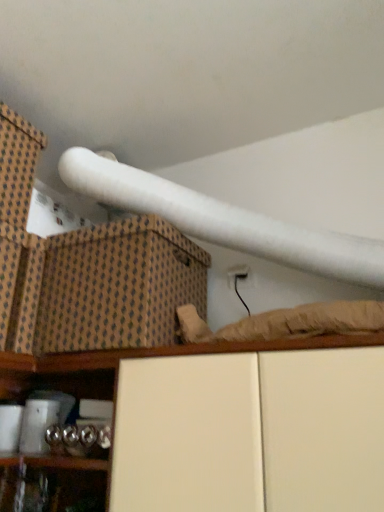
Question: Considering the relative positions of brown textured cardboard box at upper left and white matte cabinet at lower center in the image provided, is brown textured cardboard box at upper left to the right of white matte cabinet at lower center from the viewer's perspective?

Choices:
 (A) no
 (B) yes

Answer: (A)

Question: Is brown textured cardboard box at upper left positioned beyond the bounds of white matte cabinet at lower center?

Choices:
 (A) yes
 (B) no

Answer: (A)

Question: Is brown textured cardboard box at upper left not near white matte cabinet at lower center?

Choices:
 (A) yes
 (B) no

Answer: (B)

Question: Is brown textured cardboard box at upper left wider than white matte cabinet at lower center?

Choices:
 (A) no
 (B) yes

Answer: (B)

Question: From a real-world perspective, is brown textured cardboard box at upper left on top of white matte cabinet at lower center?

Choices:
 (A) no
 (B) yes

Answer: (B)

Question: Considering the positions of point (1, 117) and point (165, 310), is point (1, 117) closer or farther from the camera than point (165, 310)?

Choices:
 (A) closer
 (B) farther

Answer: (B)

Question: From the image's perspective, is brown woven box at upper left located above or below brown textured cardboard box at upper left?

Choices:
 (A) above
 (B) below

Answer: (A)

Question: Considering the positions of brown woven box at upper left and brown textured cardboard box at upper left in the image, is brown woven box at upper left wider or thinner than brown textured cardboard box at upper left?

Choices:
 (A) thin
 (B) wide

Answer: (A)

Question: From a real-world perspective, is brown woven box at upper left above or below brown textured cardboard box at upper left?

Choices:
 (A) below
 (B) above

Answer: (B)

Question: Based on their sizes in the image, would you say brown woven box at upper left is bigger or smaller than white matte cabinet at lower center?

Choices:
 (A) big
 (B) small

Answer: (B)

Question: From the image's perspective, relative to white matte cabinet at lower center, is brown woven box at upper left above or below?

Choices:
 (A) above
 (B) below

Answer: (A)

Question: Considering their positions, is brown woven box at upper left located in front of or behind white matte cabinet at lower center?

Choices:
 (A) front
 (B) behind

Answer: (B)

Question: Considering the positions of brown woven box at upper left and white matte cabinet at lower center in the image, is brown woven box at upper left taller or shorter than white matte cabinet at lower center?

Choices:
 (A) short
 (B) tall

Answer: (A)

Question: From a real-world perspective, is brown textured cardboard box at upper left above or below white matte cabinet at lower center?

Choices:
 (A) below
 (B) above

Answer: (B)

Question: In terms of height, does brown textured cardboard box at upper left look taller or shorter compared to white matte cabinet at lower center?

Choices:
 (A) short
 (B) tall

Answer: (A)